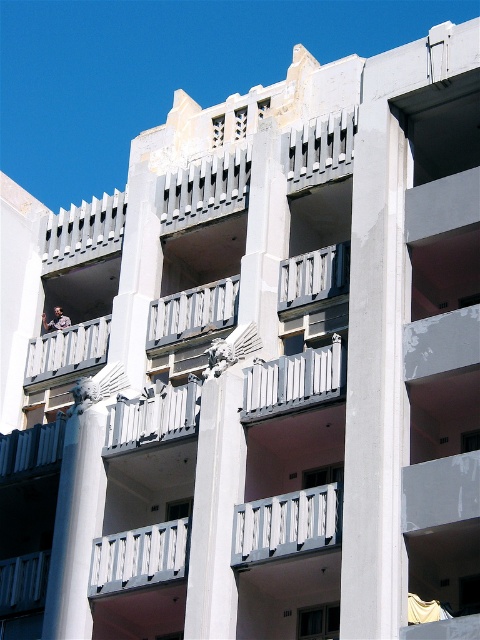
Is white smooth column at center below white painted wood at center?

No.

Does white smooth column at center have a lesser width compared to white painted wood at center?

Indeed, white smooth column at center has a lesser width compared to white painted wood at center.

You are a GUI agent. You are given a task and a screenshot of the screen. Output one action in this format:
    pyautogui.click(x=<x>, y=<y>)
    Task: Click on the white smooth column at center
    This screenshot has height=640, width=480.
    Given the screenshot: What is the action you would take?
    pyautogui.click(x=216, y=499)

Does white marble column at center lie behind white matte balustrade at center?

Yes, it is.

Between white marble column at center and white matte balustrade at center, which one is positioned lower?

white matte balustrade at center is below.

What do you see at coordinates (76, 515) in the screenshot? The width and height of the screenshot is (480, 640). I see `white marble column at center` at bounding box center [76, 515].

Find the location of a particular element. white marble column at center is located at coordinates (76, 515).

Is white marble column at center further to the viewer compared to white painted metal balustrade at center?

Yes, it is behind white painted metal balustrade at center.

Is white marble column at center above white painted metal balustrade at center?

Actually, white marble column at center is below white painted metal balustrade at center.

Is point (76, 512) positioned behind point (309, 381)?

Yes, point (76, 512) is behind point (309, 381).

Identify the location of white marble column at center. The width and height of the screenshot is (480, 640). (76, 515).